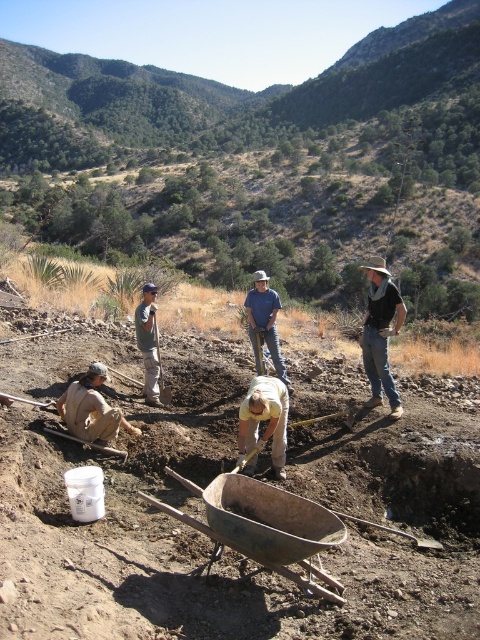
Based on the photo, can you confirm if yellow fabric shirt at center is thinner than brushed metal shovel at lower center?

No.

Which of these two, yellow fabric shirt at center or brushed metal shovel at lower center, stands shorter?

yellow fabric shirt at center is shorter.

Which is in front, point (239, 432) or point (168, 387)?

Positioned in front is point (239, 432).

The width and height of the screenshot is (480, 640). Find the location of `yellow fabric shirt at center`. yellow fabric shirt at center is located at coordinates (264, 419).

Is black leather cowboy hat at right to the right of blue denim shirt at center from the viewer's perspective?

Indeed, black leather cowboy hat at right is positioned on the right side of blue denim shirt at center.

Is the position of black leather cowboy hat at right less distant than that of blue denim shirt at center?

Answer: Yes, it is in front of blue denim shirt at center.

Who is more distant from viewer, (381,401) or (260,330)?

Point (260,330)

Image resolution: width=480 pixels, height=640 pixels. What are the coordinates of `black leather cowboy hat at right` in the screenshot? It's located at (381, 333).

Which is above, black leather cowboy hat at right or yellow fabric shirt at center?

Positioned higher is black leather cowboy hat at right.

The width and height of the screenshot is (480, 640). Describe the element at coordinates (381, 333) in the screenshot. I see `black leather cowboy hat at right` at that location.

Does point (368, 328) lie in front of point (282, 440)?

That is False.

Where is `black leather cowboy hat at right`? This screenshot has height=640, width=480. black leather cowboy hat at right is located at coordinates (381, 333).